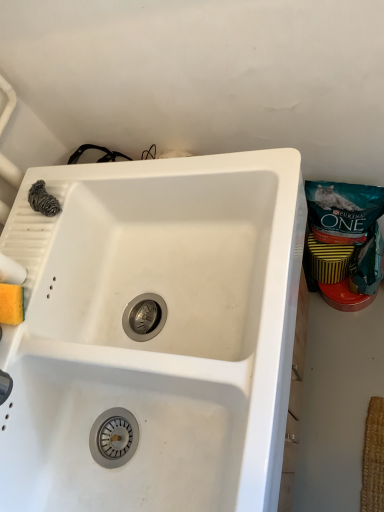
The width and height of the screenshot is (384, 512). What do you see at coordinates (157, 335) in the screenshot? I see `white ceramic sink at center` at bounding box center [157, 335].

The height and width of the screenshot is (512, 384). Find the location of `white ceramic sink at center`. white ceramic sink at center is located at coordinates (157, 335).

Find the location of a particular element. white ceramic sink at center is located at coordinates (157, 335).